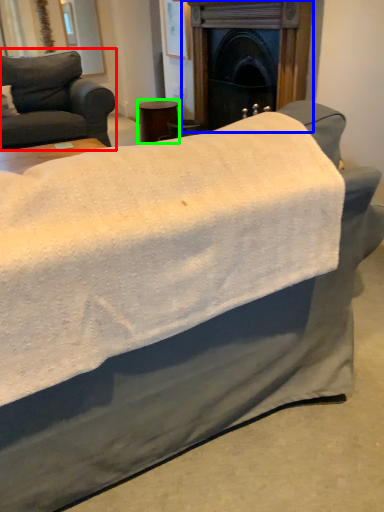
Question: Considering the real-world distances, which object is closest to studio couch (highlighted by a red box)? fireplace (highlighted by a blue box) or side table (highlighted by a green box).

Choices:
 (A) fireplace
 (B) side table

Answer: (B)